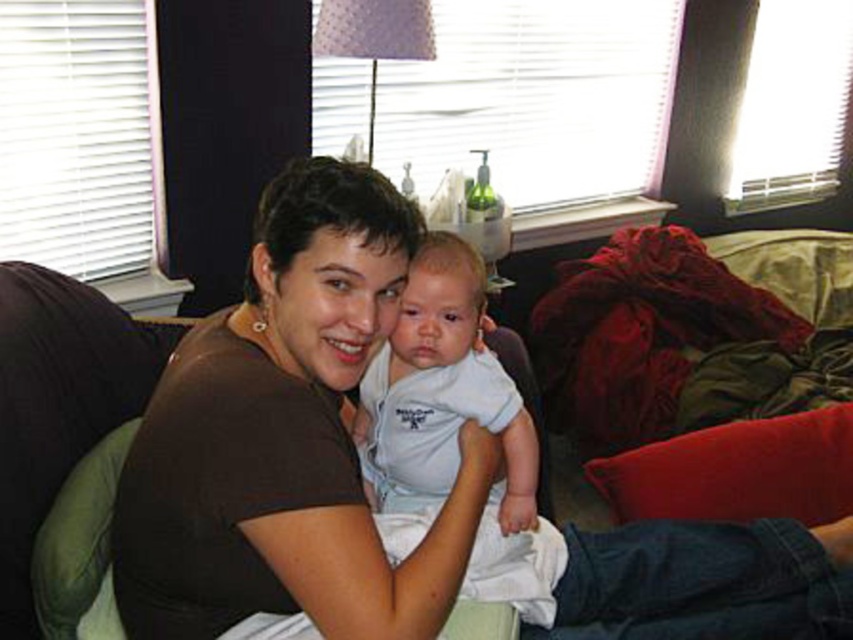
Question: In this image, where is brown matte shirt at center located relative to white cotton shirt at center?

Choices:
 (A) below
 (B) above

Answer: (A)

Question: Where is brown matte shirt at center located in relation to white cotton shirt at center in the image?

Choices:
 (A) left
 (B) right

Answer: (B)

Question: Which point appears closest to the camera in this image?

Choices:
 (A) (292, 570)
 (B) (514, 483)

Answer: (A)

Question: Which point is closer to the camera taking this photo?

Choices:
 (A) (314, 561)
 (B) (448, 332)

Answer: (A)

Question: Which point appears farthest from the camera in this image?

Choices:
 (A) (354, 314)
 (B) (410, 486)

Answer: (B)

Question: Is brown matte shirt at center positioned before white cotton shirt at center?

Choices:
 (A) yes
 (B) no

Answer: (A)